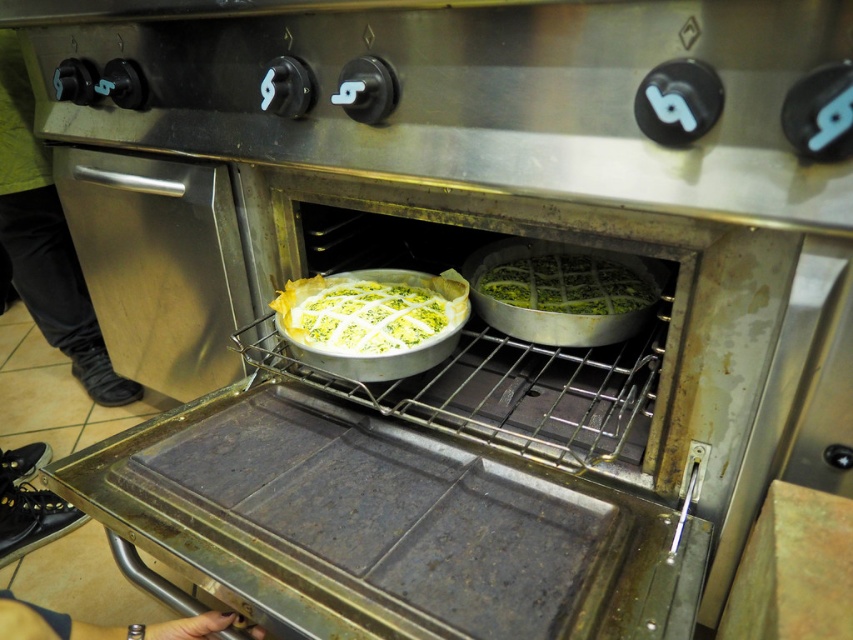
Question: Which of the following is the farthest from the observer?

Choices:
 (A) black leather shoe at lower left
 (B) green matte pie at center
 (C) green fabric pants at lower left
 (D) white paper pie crust at center

Answer: (C)

Question: Which object appears closest to the camera in this image?

Choices:
 (A) green fabric pants at lower left
 (B) white paper pie crust at center
 (C) black leather shoe at lower left
 (D) green matte pie at center

Answer: (C)

Question: Can you confirm if green fabric pants at lower left is positioned below black leather shoe at lower left?

Choices:
 (A) no
 (B) yes

Answer: (A)

Question: Can you confirm if green matte pie at center is positioned below black leather shoe at lower left?

Choices:
 (A) no
 (B) yes

Answer: (A)

Question: Which of the following is the farthest from the observer?

Choices:
 (A) (x=407, y=305)
 (B) (x=535, y=308)
 (C) (x=35, y=605)
 (D) (x=49, y=323)

Answer: (D)

Question: Does green matte pie at center have a smaller size compared to black leather shoe at lower left?

Choices:
 (A) yes
 (B) no

Answer: (B)